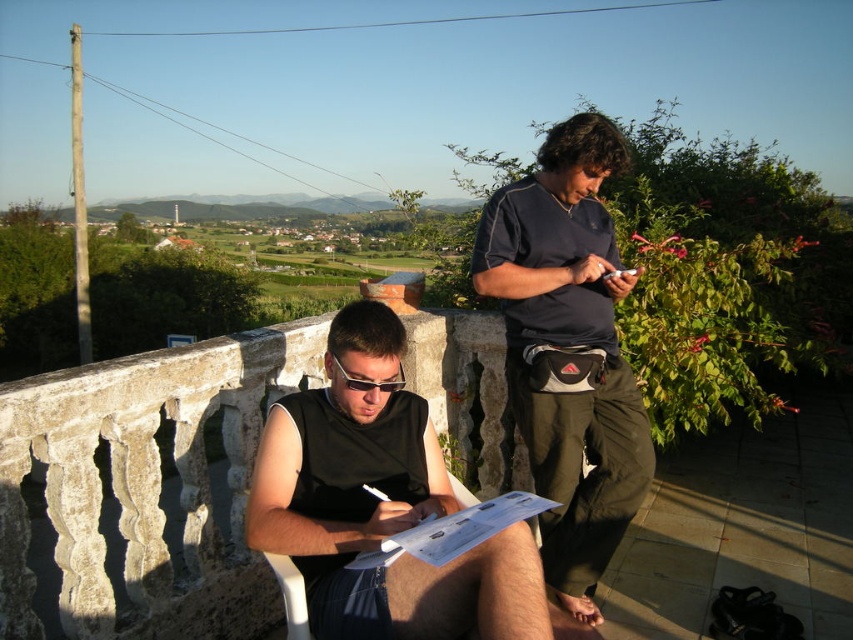
You are standing on the balcony and want to reach the point marked at coordinates (407, 403). If you can extend your arm 1.8 meters, can you reach it?

The point at (407, 403) is 2.24 meters away from the viewer. Since your arm can only extend 1.8 meters, you cannot reach it.

You are standing on the balcony and want to place a small potted plant at the exact location of the point marked as point [379,502]. Is there enough space there to place the plant without it being in the way of the black matte vest at center?

The black matte vest at center is located at point [379,502], so placing the potted plant there would directly overlap with the vest, making it obstructive.

You are standing on the balcony and need to place a small plant pot. The plant pot must be placed exactly where the black matte vest at center is currently located. Is there enough space at that location to place the pot?

The black matte vest at center is located at point (379, 502). Since the vest is at that exact coordinate, placing the plant pot there would require moving the vest first.